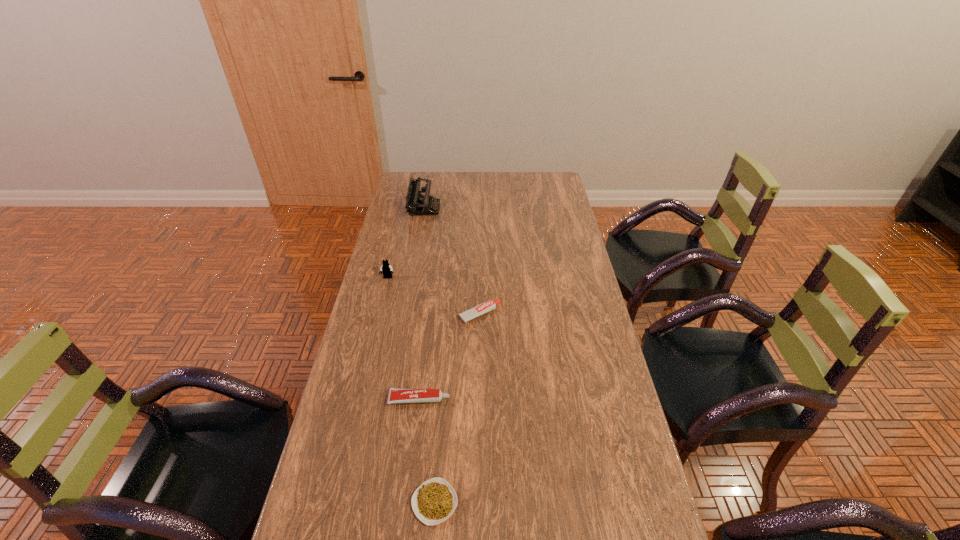
The image size is (960, 540). I want to click on vacant region at the left edge, so click(415, 234).

The image size is (960, 540). What are the coordinates of `vacant region at the right edge` in the screenshot? It's located at point(568,348).

At what (x,y) coordinates should I click in order to perform the action: click on free space between the nearer toothpaste and the third nearest object. Please return your answer as a coordinate pair (x, y). This screenshot has height=540, width=960. Looking at the image, I should click on (449, 357).

Locate an element on the screen. The image size is (960, 540). free spot between the second nearest object and the farthest object is located at coordinates (422, 304).

The height and width of the screenshot is (540, 960). I want to click on unoccupied area between the third farthest object and the typewriter, so click(x=452, y=261).

I want to click on vacant region between the fourth farthest object and the Lego, so click(x=403, y=339).

Where is `free space between the fourth farthest object and the typewriter`? Image resolution: width=960 pixels, height=540 pixels. free space between the fourth farthest object and the typewriter is located at coordinates (422, 304).

I want to click on free space between the shortest object and the left toothpaste, so click(427, 451).

The height and width of the screenshot is (540, 960). Identify the location of empty space between the farther toothpaste and the fourth shortest object. (434, 296).

Image resolution: width=960 pixels, height=540 pixels. I want to click on vacant space in between the second farthest object and the nearer toothpaste, so click(403, 339).